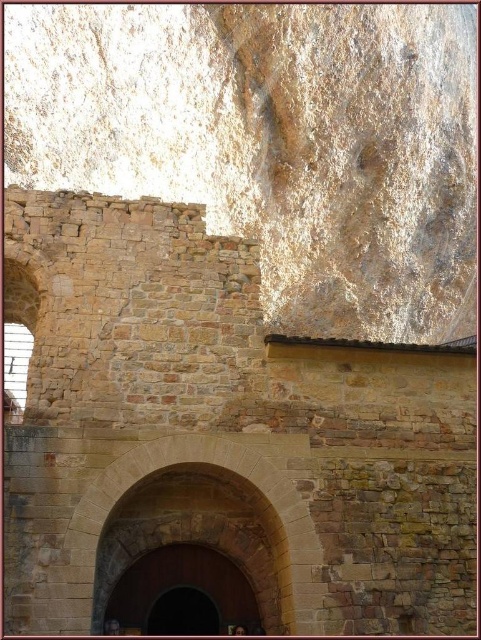
Between smooth stone archway at center and brown wooden door at center, which one appears on the right side from the viewer's perspective?

smooth stone archway at center is more to the right.

Between point (283, 515) and point (255, 604), which one is positioned behind?

The point (255, 604) is more distant.

Does point (176, 452) lie behind point (139, 570)?

No, (176, 452) is in front of (139, 570).

What are the coordinates of `smooth stone archway at center` in the screenshot? It's located at (200, 461).